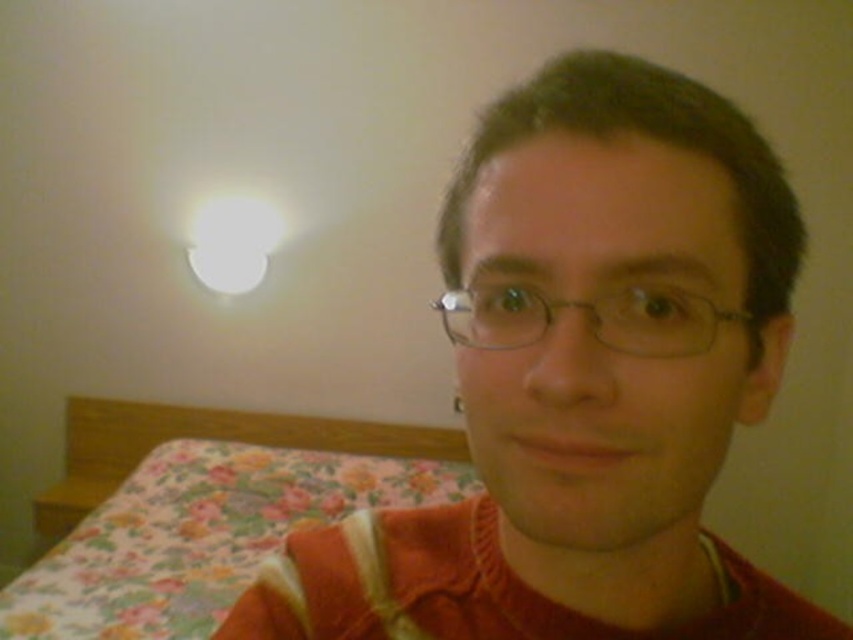
Is floral fabric bed at lower left thinner than metallic wireframe glasses at center?

Incorrect, floral fabric bed at lower left's width is not less than metallic wireframe glasses at center's.

Who is more forward, [160,627] or [688,326]?

Point [688,326] is in front.

The image size is (853, 640). What are the coordinates of `floral fabric bed at lower left` in the screenshot? It's located at (207, 515).

Is point (663, 488) closer to viewer compared to point (502, 337)?

No.

Does orange fabric at center lie behind metallic wireframe glasses at center?

That is False.

What do you see at coordinates (582, 381) in the screenshot?
I see `orange fabric at center` at bounding box center [582, 381].

Image resolution: width=853 pixels, height=640 pixels. Find the location of `orange fabric at center`. orange fabric at center is located at coordinates (582, 381).

Consider the image. Is orange fabric at center above floral fabric bed at lower left?

Indeed, orange fabric at center is positioned over floral fabric bed at lower left.

Can you confirm if orange fabric at center is positioned to the left of floral fabric bed at lower left?

No, orange fabric at center is not to the left of floral fabric bed at lower left.

What do you see at coordinates (582, 381) in the screenshot? I see `orange fabric at center` at bounding box center [582, 381].

Locate an element on the screen. The height and width of the screenshot is (640, 853). orange fabric at center is located at coordinates (582, 381).